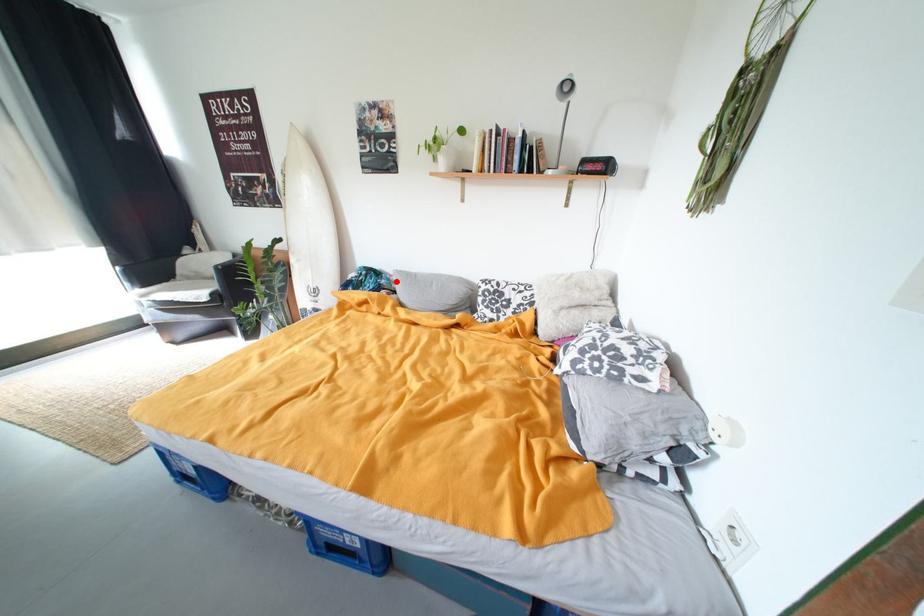
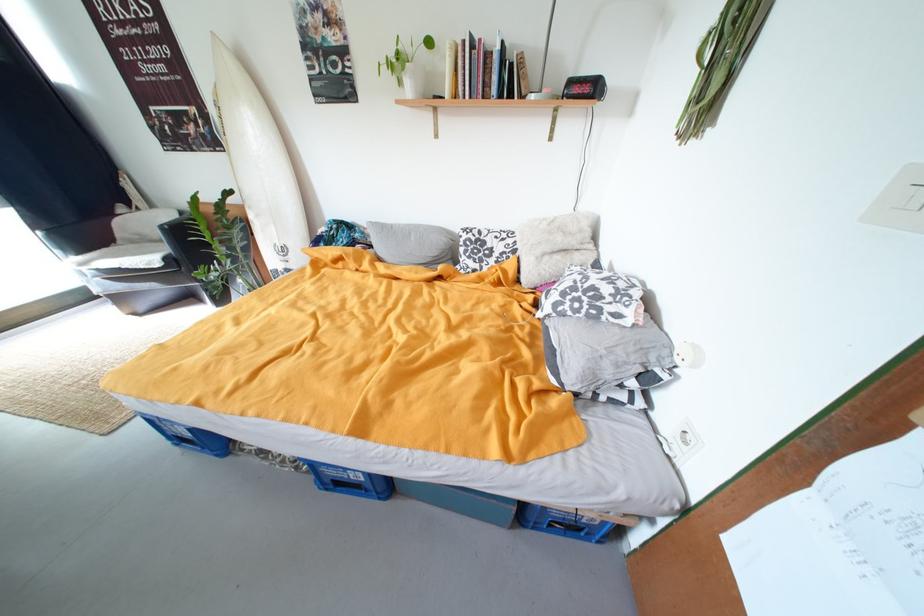
Locate, in the second image, the point that corresponds to the highlighted location in the first image.

(371, 235)